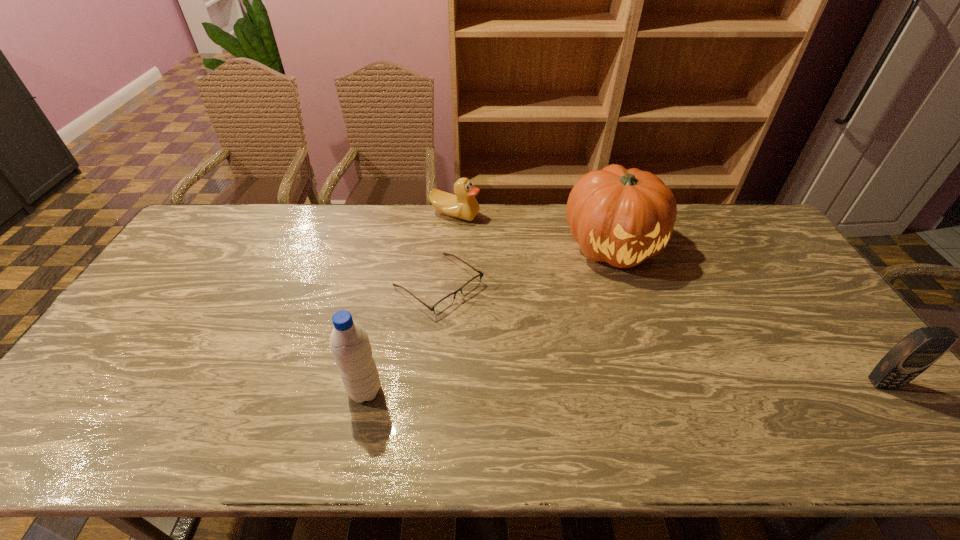
You are a GUI agent. You are given a task and a screenshot of the screen. Output one action in this format:
    pyautogui.click(x=<x>, y=<y>)
    Task: Click on the free space in the image that satisfies the following two spatial constraints: 1. on the back side of the shortest object; 2. on the left side of the water bottle
    The image size is (960, 540).
    Given the screenshot: What is the action you would take?
    pyautogui.click(x=388, y=285)